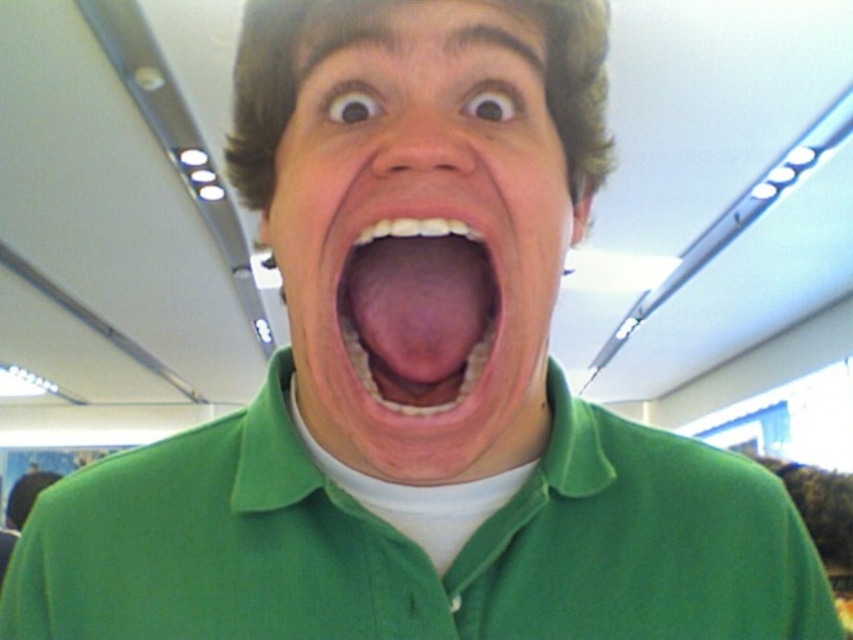
Looking at this image, you are a photographer adjusting lighting in a studio. You have two subjects in your frame, the green matte face at center and the green matte polo shirt at center. Which subject should you adjust the lighting for to ensure proper exposure, considering their size in the frame?

The green matte face at center has a smaller size compared to the green matte polo shirt at center. Since the face is smaller, it may require more focused lighting adjustments to ensure proper exposure, especially since the polo shirt might already be well lit due to its larger presence in the frame.